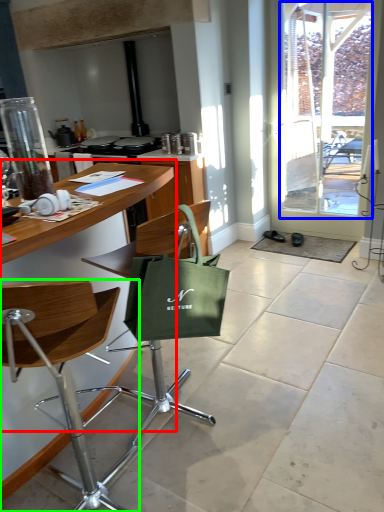
Question: Which object is positioned closest to table (highlighted by a red box)? Select from window screen (highlighted by a blue box) and chair (highlighted by a green box).

Choices:
 (A) window screen
 (B) chair

Answer: (B)